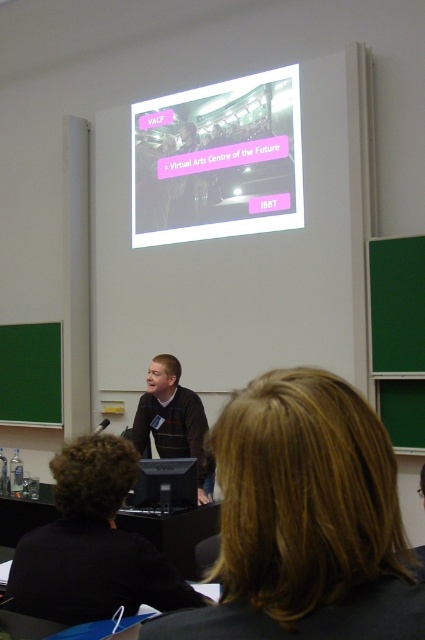
You are sitting in the classroom and want to see both the matte plastic projector screen at upper center and the striped sweater at center. Which one is closer to you?

The matte plastic projector screen at upper center is closer to you because it is further to the viewer than the striped sweater at center.